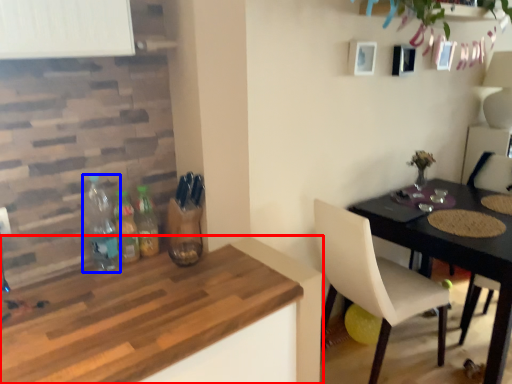
Question: Which object appears closest to the camera in this image, kitchen & dining room table (highlighted by a red box) or bottle (highlighted by a blue box)?

Choices:
 (A) kitchen & dining room table
 (B) bottle

Answer: (A)